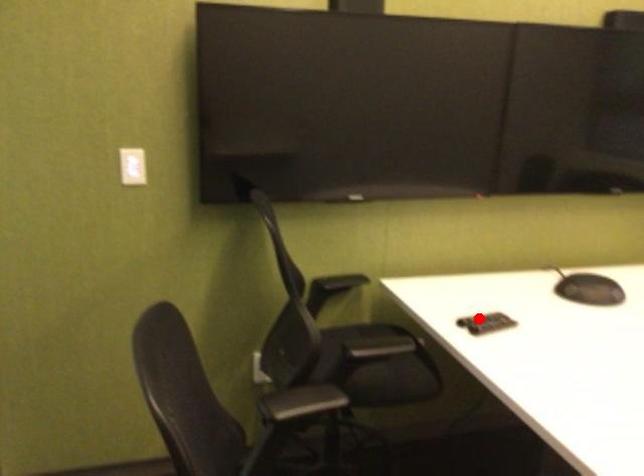
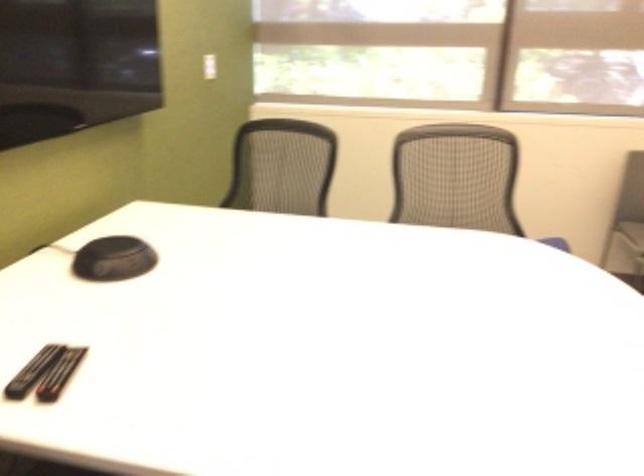
Question: I am providing you with two images of the same scene from different viewpoints. A red point is shown in image1. For the corresponding object point in image2, is it positioned nearer or farther from the camera?

Choices:
 (A) Nearer
 (B) Farther

Answer: (A)